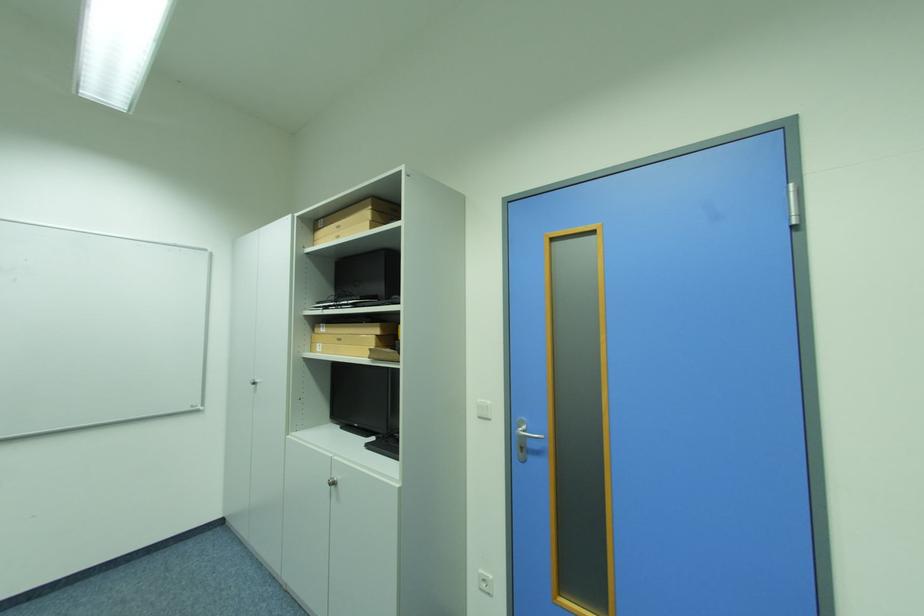
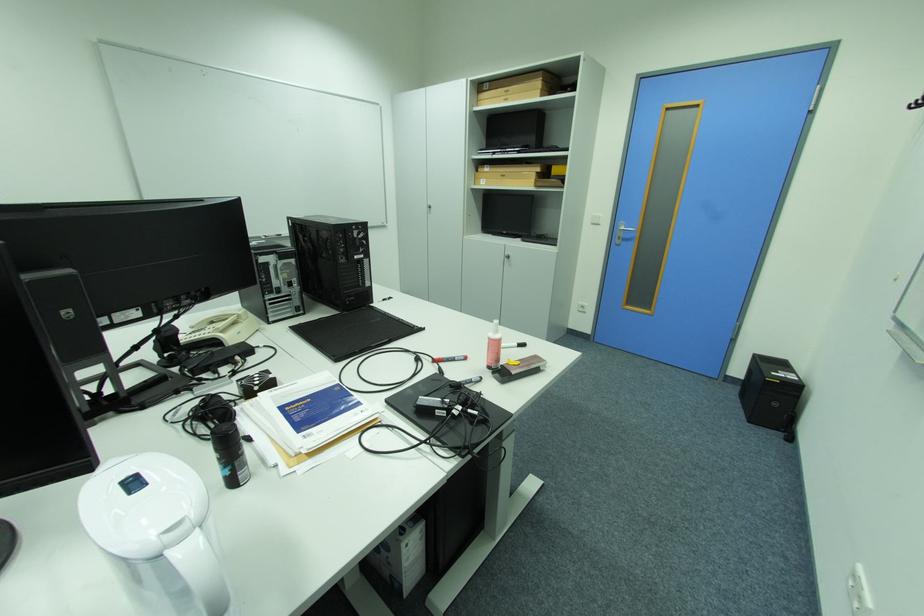
The point at (x=345, y=238) is marked in the first image. Where is the corresponding point in the second image?

(514, 100)